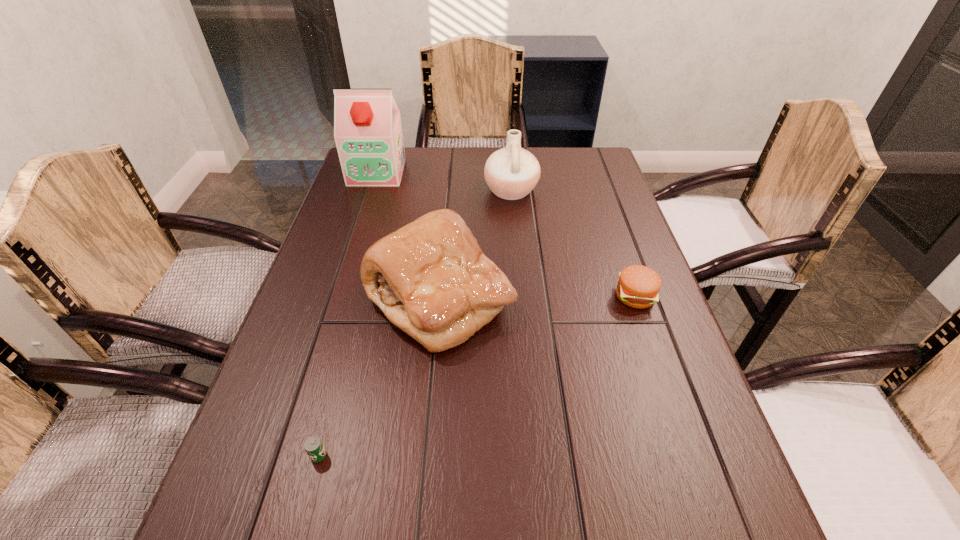
Locate an element on the screen. The height and width of the screenshot is (540, 960). object that is at the far left corner is located at coordinates (368, 134).

I want to click on free region at the far edge of the desktop, so click(x=448, y=161).

Find the location of `vacant space at the left edge of the desktop`. vacant space at the left edge of the desktop is located at coordinates (326, 437).

The image size is (960, 540). In order to click on vacant position at the right edge of the desktop in this screenshot , I will do `click(607, 253)`.

Find the location of a particular element. empty space that is in between the beer can and the soya milk is located at coordinates (348, 314).

Identify the location of vacant area between the fourth tallest object and the soya milk. The image size is (960, 540). (506, 234).

Locate an element on the screen. The width and height of the screenshot is (960, 540). vacant space in between the fourth tallest object and the bread is located at coordinates (538, 298).

What are the coordinates of `free space that is in between the pottery and the hamburger` in the screenshot? It's located at (573, 243).

Identify the location of free point between the tallest object and the pottery. The height and width of the screenshot is (540, 960). (444, 181).

Locate an element on the screen. empty location between the beer can and the tallest object is located at coordinates (348, 314).